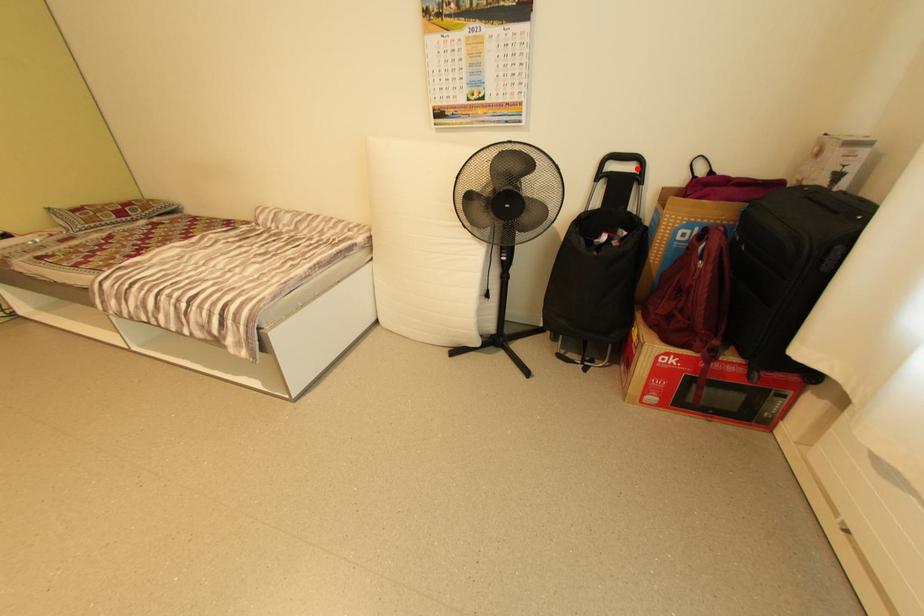
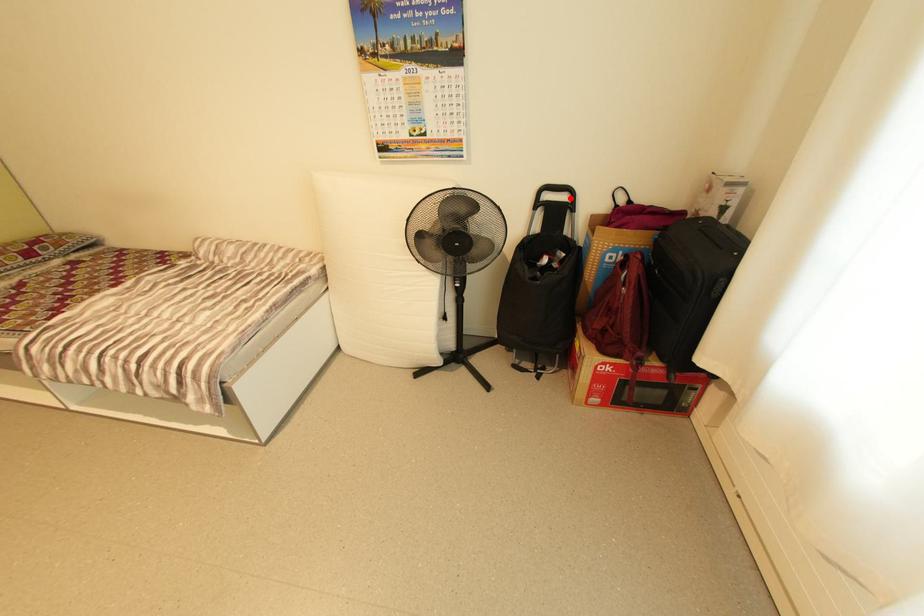
I am providing you with two images of the same scene from different viewpoints. A red point is marked on the first image and another point is marked on the second image. Does the point marked in image1 correspond to the same location as the one in image2?

Yes